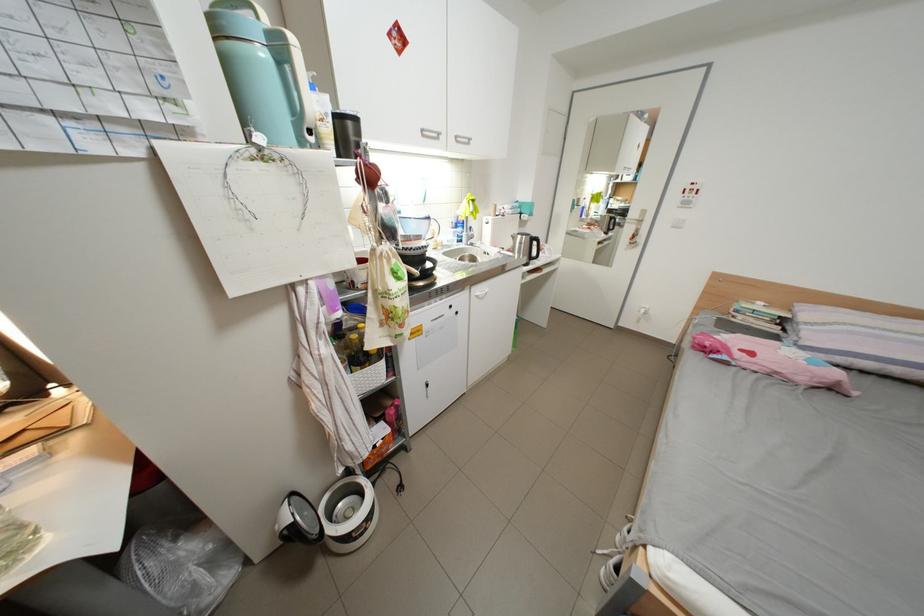
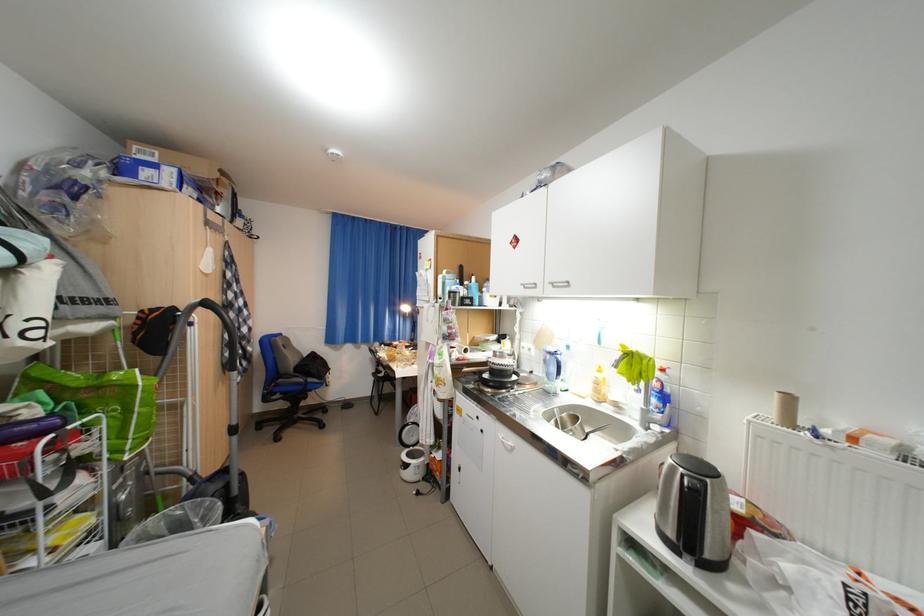
Locate, in the second image, the point that corresponds to pixel 468 139 in the first image.

(564, 285)